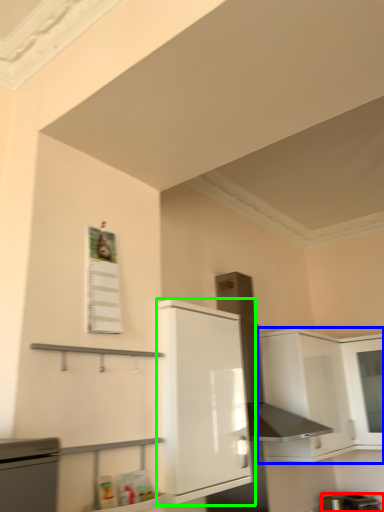
Question: Which is nearer to the appliance (highlighted by a red box)? cabinetry (highlighted by a blue box) or cabinetry (highlighted by a green box).

Choices:
 (A) cabinetry
 (B) cabinetry

Answer: (A)